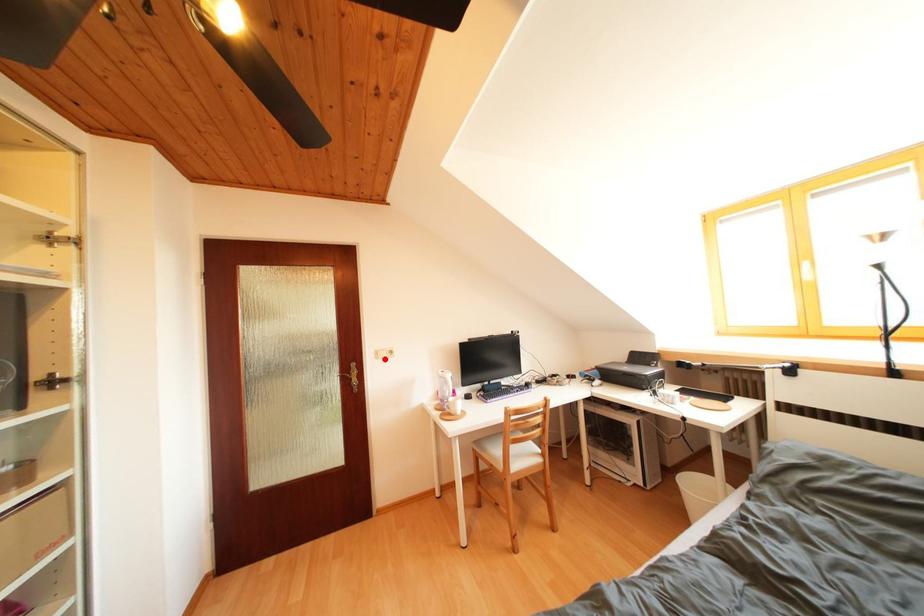
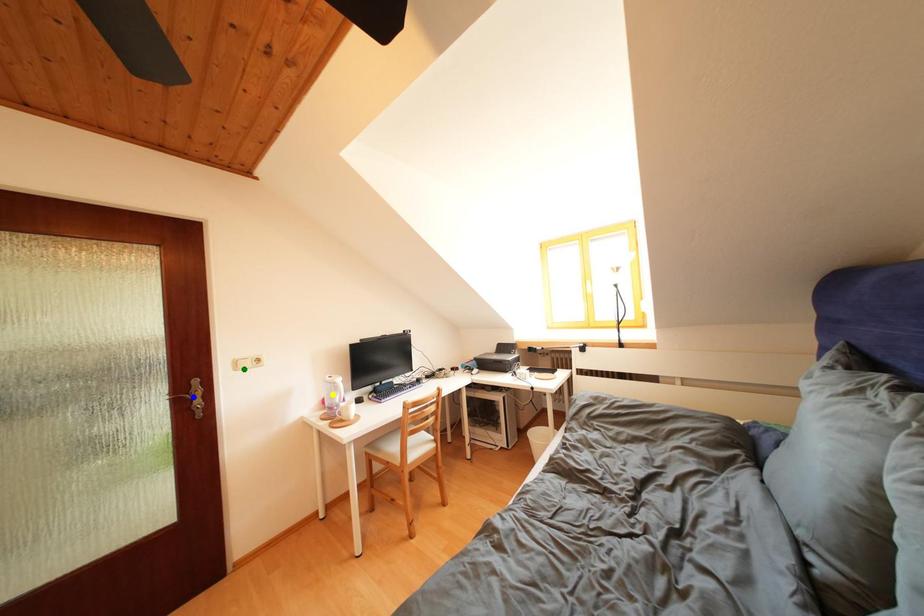
Question: I am providing you with two images of the same scene from different viewpoints. A red point is marked on the first image. You are given multiple points on the second image. Which spot in image 2 lines up with the point in image 1?

Choices:
 (A) green point
 (B) yellow point
 (C) blue point

Answer: (A)